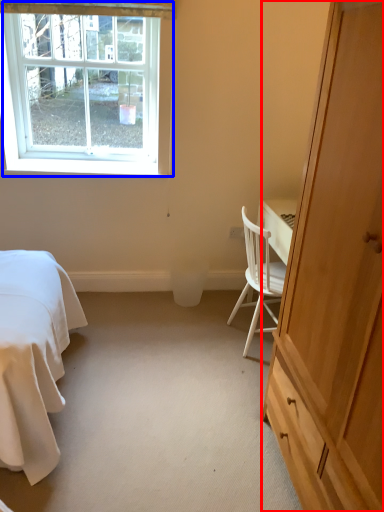
Question: Which point is closer to the camera, cabinetry (highlighted by a red box) or window (highlighted by a blue box)?

Choices:
 (A) cabinetry
 (B) window

Answer: (A)